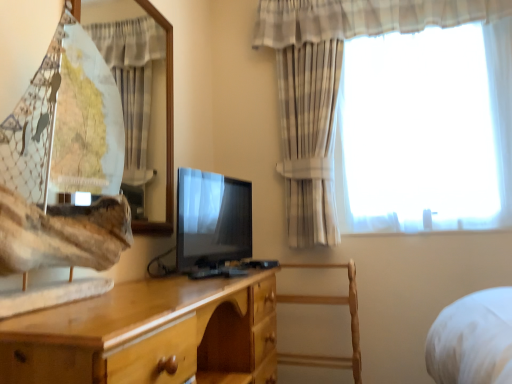
Question: Considering the relative sizes of light wood chest of drawers at center and wooden chair at center in the image provided, is light wood chest of drawers at center smaller than wooden chair at center?

Choices:
 (A) yes
 (B) no

Answer: (B)

Question: Considering the relative positions of light wood chest of drawers at center and wooden chair at center in the image provided, is light wood chest of drawers at center to the right of wooden chair at center from the viewer's perspective?

Choices:
 (A) no
 (B) yes

Answer: (A)

Question: From the image's perspective, is light wood chest of drawers at center on wooden chair at center?

Choices:
 (A) yes
 (B) no

Answer: (A)

Question: Could wooden chair at center be considered to be inside light wood chest of drawers at center?

Choices:
 (A) no
 (B) yes

Answer: (A)

Question: Is light wood chest of drawers at center closer to the viewer compared to wooden chair at center?

Choices:
 (A) no
 (B) yes

Answer: (B)

Question: Can you confirm if light wood chest of drawers at center is shorter than wooden chair at center?

Choices:
 (A) no
 (B) yes

Answer: (B)

Question: Could you tell me if matte black tv at center is turned towards plaid fabric curtain at upper right, the 1th curtain from the right?

Choices:
 (A) no
 (B) yes

Answer: (A)

Question: Are matte black tv at center and plaid fabric curtain at upper right, the 1th curtain from the right, beside each other?

Choices:
 (A) no
 (B) yes

Answer: (A)

Question: Are matte black tv at center and plaid fabric curtain at upper right, the 1th curtain from the right, far apart?

Choices:
 (A) no
 (B) yes

Answer: (A)

Question: Is matte black tv at center oriented away from plaid fabric curtain at upper right, the second curtain in the left-to-right sequence?

Choices:
 (A) no
 (B) yes

Answer: (A)

Question: Can you confirm if matte black tv at center is positioned to the right of plaid fabric curtain at upper right, the second curtain in the left-to-right sequence?

Choices:
 (A) yes
 (B) no

Answer: (B)

Question: From the image's perspective, does matte black tv at center appear higher than plaid fabric curtain at upper right, the second curtain in the left-to-right sequence?

Choices:
 (A) no
 (B) yes

Answer: (A)

Question: Can you confirm if wooden chair at center is shorter than plaid fabric curtain at upper right, the second curtain in the left-to-right sequence?

Choices:
 (A) yes
 (B) no

Answer: (A)